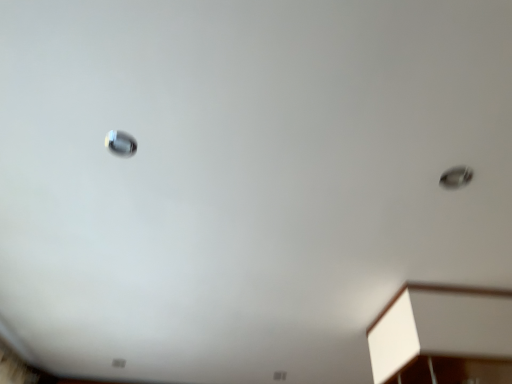
Describe the element at coordinates (120, 143) in the screenshot. This screenshot has width=512, height=384. I see `satin silver droplight at upper left, positioned as the 2th droplight in bottom-to-top order` at that location.

Measure the distance between metallic silver droplight at upper right, arranged as the 1th droplight when viewed from the back, and camera.

metallic silver droplight at upper right, arranged as the 1th droplight when viewed from the back, and camera are 3.69 feet apart from each other.

The height and width of the screenshot is (384, 512). In order to click on white matte cabinet at lower right in this screenshot , I will do `click(443, 337)`.

The height and width of the screenshot is (384, 512). Find the location of `satin silver droplight at upper left, which ranks as the first droplight in top-to-bottom order`. satin silver droplight at upper left, which ranks as the first droplight in top-to-bottom order is located at coordinates (120, 143).

In terms of height, does metallic silver droplight at upper right, which is the 2th droplight in front-to-back order, look taller or shorter compared to satin silver droplight at upper left, positioned as the 2th droplight in right-to-left order?

Considering their sizes, metallic silver droplight at upper right, which is the 2th droplight in front-to-back order, has more height than satin silver droplight at upper left, positioned as the 2th droplight in right-to-left order.

Is metallic silver droplight at upper right, which is counted as the first droplight, starting from the right, far from satin silver droplight at upper left, marked as the first droplight in a left-to-right arrangement?

metallic silver droplight at upper right, which is counted as the first droplight, starting from the right, is near satin silver droplight at upper left, marked as the first droplight in a left-to-right arrangement, not far away.

Between metallic silver droplight at upper right, which is the 2th droplight in front-to-back order, and satin silver droplight at upper left, positioned as the 2th droplight in right-to-left order, which one appears on the left side from the viewer's perspective?

satin silver droplight at upper left, positioned as the 2th droplight in right-to-left order.

Between metallic silver droplight at upper right, which is counted as the 2th droplight, starting from the left, and satin silver droplight at upper left, marked as the first droplight in a left-to-right arrangement, which one has smaller width?

satin silver droplight at upper left, marked as the first droplight in a left-to-right arrangement, is thinner.

Which of these two, white matte cabinet at lower right or metallic silver droplight at upper right, which is counted as the first droplight, starting from the right, is bigger?

Bigger between the two is white matte cabinet at lower right.

I want to click on the 1st droplight in front of the white matte cabinet at lower right, so click(x=456, y=177).

Which point is more forward, (495, 361) or (463, 185)?

Positioned in front is point (463, 185).

Looking at their sizes, would you say white matte cabinet at lower right is wider or thinner than metallic silver droplight at upper right, acting as the first droplight starting from the bottom?

white matte cabinet at lower right is wider than metallic silver droplight at upper right, acting as the first droplight starting from the bottom.

From a real-world perspective, is white matte cabinet at lower right beneath satin silver droplight at upper left, marked as the first droplight in a left-to-right arrangement?

Indeed, from a real-world perspective, white matte cabinet at lower right is positioned beneath satin silver droplight at upper left, marked as the first droplight in a left-to-right arrangement.

Is the position of white matte cabinet at lower right more distant than that of satin silver droplight at upper left, positioned as the first droplight in front-to-back order?

Yes, white matte cabinet at lower right is further from the viewer.

Considering the positions of point (378, 329) and point (109, 137), is point (378, 329) closer or farther from the camera than point (109, 137)?

Clearly, point (378, 329) is more distant from the camera than point (109, 137).

Can you confirm if white matte cabinet at lower right is positioned to the left of satin silver droplight at upper left, positioned as the first droplight in front-to-back order?

Incorrect, white matte cabinet at lower right is not on the left side of satin silver droplight at upper left, positioned as the first droplight in front-to-back order.

From the image's perspective, does satin silver droplight at upper left, the 2th droplight positioned from the back, appear higher than metallic silver droplight at upper right, which is counted as the 2th droplight, starting from the left?

Yes, from the image's perspective, satin silver droplight at upper left, the 2th droplight positioned from the back, is above metallic silver droplight at upper right, which is counted as the 2th droplight, starting from the left.

Considering the relative sizes of satin silver droplight at upper left, positioned as the first droplight in front-to-back order, and metallic silver droplight at upper right, which is the 2th droplight in front-to-back order, in the image provided, is satin silver droplight at upper left, positioned as the first droplight in front-to-back order, shorter than metallic silver droplight at upper right, which is the 2th droplight in front-to-back order,?

Yes, satin silver droplight at upper left, positioned as the first droplight in front-to-back order, is shorter than metallic silver droplight at upper right, which is the 2th droplight in front-to-back order.

Locate an element on the screen. droplight below the satin silver droplight at upper left, marked as the first droplight in a left-to-right arrangement (from a real-world perspective) is located at coordinates pyautogui.click(x=456, y=177).

Which is in front, point (110, 145) or point (460, 177)?

The point (110, 145) is closer.

Who is smaller, satin silver droplight at upper left, the 2th droplight positioned from the back, or white matte cabinet at lower right?

Smaller between the two is satin silver droplight at upper left, the 2th droplight positioned from the back.

Could you tell me if satin silver droplight at upper left, positioned as the first droplight in front-to-back order, is turned towards white matte cabinet at lower right?

No.

Based on the photo, is satin silver droplight at upper left, positioned as the 2th droplight in bottom-to-top order, thinner than white matte cabinet at lower right?

Indeed, satin silver droplight at upper left, positioned as the 2th droplight in bottom-to-top order, has a lesser width compared to white matte cabinet at lower right.

Is satin silver droplight at upper left, the 2th droplight positioned from the back, to the left of white matte cabinet at lower right from the viewer's perspective?

Yes.

Which is behind, metallic silver droplight at upper right, arranged as the 1th droplight when viewed from the back, or white matte cabinet at lower right?

white matte cabinet at lower right is behind.

From the image's perspective, which is below, metallic silver droplight at upper right, which is counted as the 2th droplight, starting from the left, or white matte cabinet at lower right?

white matte cabinet at lower right, from the image's perspective.

Based on their sizes in the image, would you say metallic silver droplight at upper right, which is counted as the first droplight, starting from the right, is bigger or smaller than white matte cabinet at lower right?

In the image, metallic silver droplight at upper right, which is counted as the first droplight, starting from the right, appears to be smaller than white matte cabinet at lower right.

Is metallic silver droplight at upper right, arranged as the 1th droplight when viewed from the back, situated inside white matte cabinet at lower right or outside?

metallic silver droplight at upper right, arranged as the 1th droplight when viewed from the back, is outside white matte cabinet at lower right.

This screenshot has height=384, width=512. Find the location of `droplight behind the satin silver droplight at upper left, positioned as the 2th droplight in right-to-left order`. droplight behind the satin silver droplight at upper left, positioned as the 2th droplight in right-to-left order is located at coordinates (456, 177).

From the image's perspective, count 1st droplights upward from the white matte cabinet at lower right and point to it. Please provide its 2D coordinates.

[(456, 177)]

Which object lies nearer to the anchor point white matte cabinet at lower right, metallic silver droplight at upper right, acting as the first droplight starting from the bottom, or satin silver droplight at upper left, positioned as the 2th droplight in bottom-to-top order?

metallic silver droplight at upper right, acting as the first droplight starting from the bottom.

Considering their positions, is white matte cabinet at lower right positioned further to metallic silver droplight at upper right, which is counted as the first droplight, starting from the right, than satin silver droplight at upper left, positioned as the 2th droplight in right-to-left order?

satin silver droplight at upper left, positioned as the 2th droplight in right-to-left order, is further to metallic silver droplight at upper right, which is counted as the first droplight, starting from the right.

Looking at the image, which one is located further to satin silver droplight at upper left, the 2th droplight positioned from the back, metallic silver droplight at upper right, acting as the first droplight starting from the bottom, or white matte cabinet at lower right?

white matte cabinet at lower right lies further to satin silver droplight at upper left, the 2th droplight positioned from the back, than the other object.

Estimate the real-world distances between objects in this image. Which object is closer to white matte cabinet at lower right, satin silver droplight at upper left, positioned as the 2th droplight in right-to-left order, or metallic silver droplight at upper right, which is counted as the 2th droplight, starting from the top?

metallic silver droplight at upper right, which is counted as the 2th droplight, starting from the top, is closer to white matte cabinet at lower right.

Looking at the image, which one is located closer to satin silver droplight at upper left, marked as the first droplight in a left-to-right arrangement, white matte cabinet at lower right or metallic silver droplight at upper right, acting as the first droplight starting from the bottom?

metallic silver droplight at upper right, acting as the first droplight starting from the bottom, is positioned closer to the anchor satin silver droplight at upper left, marked as the first droplight in a left-to-right arrangement.

Which object lies further to the anchor point metallic silver droplight at upper right, which is the 2th droplight in front-to-back order, satin silver droplight at upper left, positioned as the first droplight in front-to-back order, or white matte cabinet at lower right?

satin silver droplight at upper left, positioned as the first droplight in front-to-back order, is further to metallic silver droplight at upper right, which is the 2th droplight in front-to-back order.

You are a GUI agent. You are given a task and a screenshot of the screen. Output one action in this format:
    pyautogui.click(x=<x>, y=<y>)
    Task: Click on the droplight located between satin silver droplight at upper left, positioned as the first droplight in front-to-back order, and white matte cabinet at lower right in the left-right direction
    Image resolution: width=512 pixels, height=384 pixels.
    Given the screenshot: What is the action you would take?
    pyautogui.click(x=456, y=177)